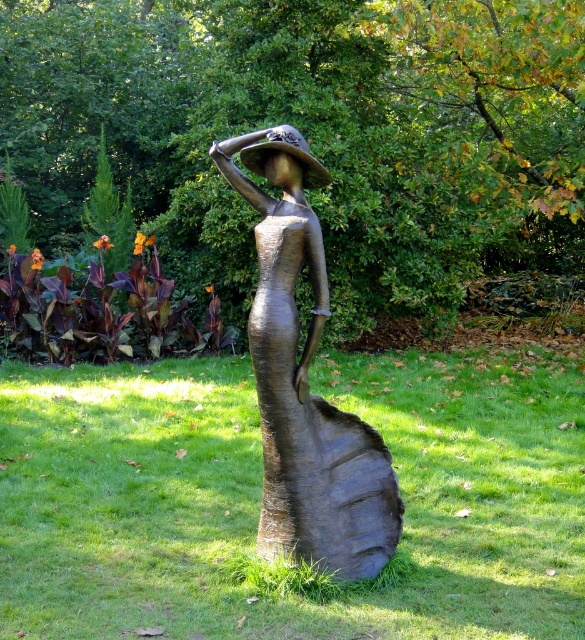
Question: Does green grass at center have a larger size compared to bronze statue at center?

Choices:
 (A) yes
 (B) no

Answer: (B)

Question: Is green grass at center behind bronze statue at center?

Choices:
 (A) yes
 (B) no

Answer: (A)

Question: Which point appears closest to the camera in this image?

Choices:
 (A) (439, 586)
 (B) (347, 563)

Answer: (B)

Question: Can you confirm if green grass at center is wider than bronze statue at center?

Choices:
 (A) no
 (B) yes

Answer: (B)